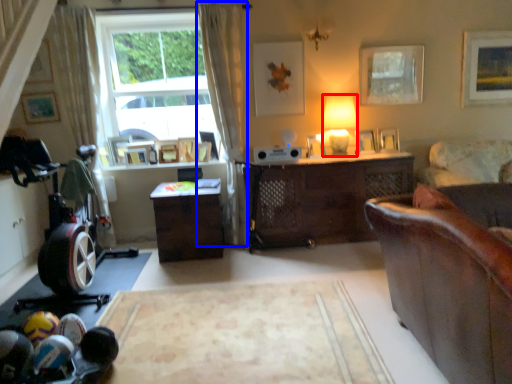
Question: Which of the following is the farthest to the observer, lamp (highlighted by a red box) or curtain (highlighted by a blue box)?

Choices:
 (A) lamp
 (B) curtain

Answer: (A)